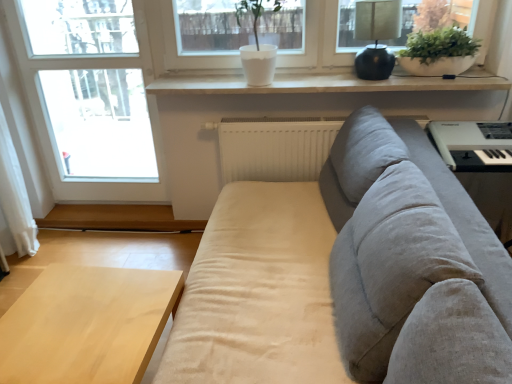
Locate an element on the screen. This screenshot has height=384, width=512. vacant point above light wood table at lower left (from a real-world perspective) is located at coordinates (76, 313).